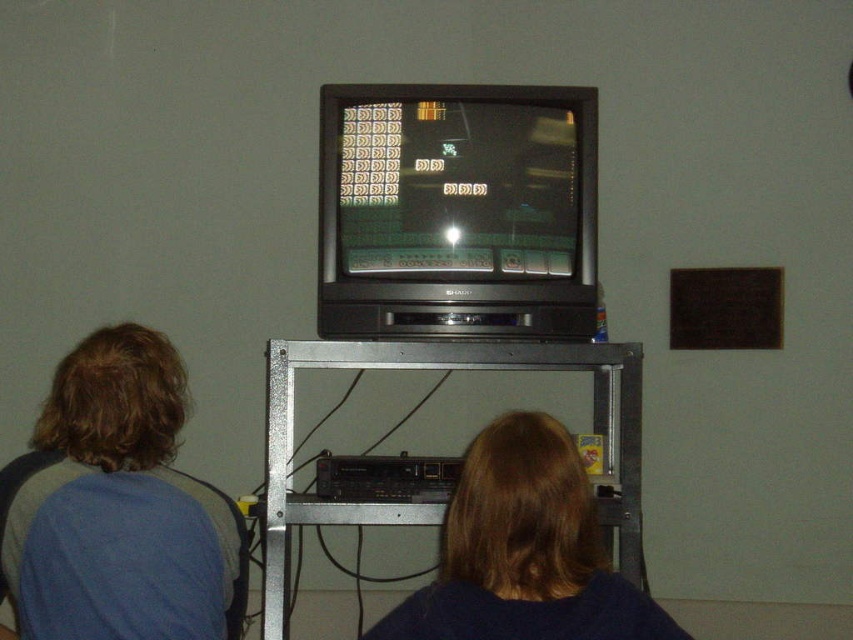
At what (x,y) coordinates should I click in order to perform the action: click on blue fabric shirt at left. Please return your answer as a coordinate pair (x, y). The width and height of the screenshot is (853, 640). Looking at the image, I should click on (119, 506).

Which is below, blue fabric shirt at left or dark blue sweater at lower center?

dark blue sweater at lower center

Between point (96, 492) and point (512, 628), which one is positioned behind?

The point (96, 492) is behind.

The width and height of the screenshot is (853, 640). Identify the location of blue fabric shirt at left. (119, 506).

Does black plastic tv at center lie behind blue fabric shirt at left?

That is True.

Where is `black plastic tv at center`? This screenshot has width=853, height=640. black plastic tv at center is located at coordinates (457, 211).

Is point (433, 193) in front of point (194, 618)?

No.

The image size is (853, 640). Identify the location of black plastic tv at center. (457, 211).

Is black plastic tv at center taller than dark blue sweater at lower center?

Yes.

Describe the element at coordinates (457, 211) in the screenshot. The width and height of the screenshot is (853, 640). I see `black plastic tv at center` at that location.

Locate an element on the screen. The image size is (853, 640). black plastic tv at center is located at coordinates (457, 211).